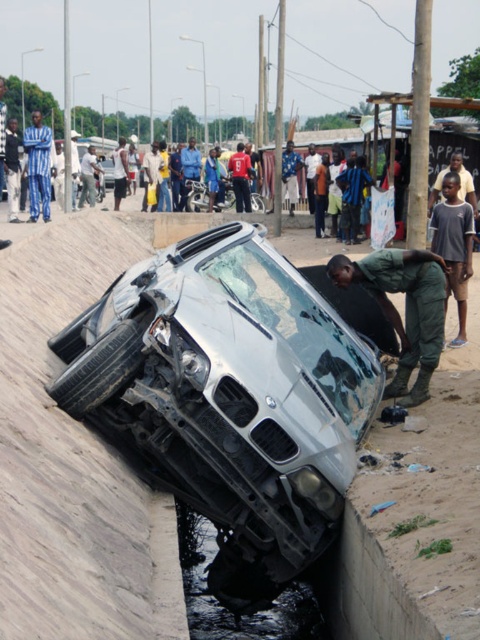
You are a traffic officer assessing the accident scene. You notice a silver metallic motorcycle at center and a red fabric shirt at center. Which object is positioned lower in the image?

The silver metallic motorcycle at center is located below the red fabric shirt at center, so the motorcycle is positioned lower.

You are a first responder arriving at the scene of the overturned silver BMW sedan in the drainage ditch. You notice a silver metallic motorcycle at center and a red fabric shirt at center. Which object is closer to you as you approach the scene?

The silver metallic motorcycle at center is closer to you because it is further to the viewer than the red fabric shirt at center, meaning it is positioned nearer in the visual perspective.

You are a first responder arriving at the scene of the accident. You see the silver metallic car at lower center and the light brown skin at center. Which object is closer to the left side of the scene?

The silver metallic car at lower center is closer to the left side of the scene because it is positioned to the left of the light brown skin at center.